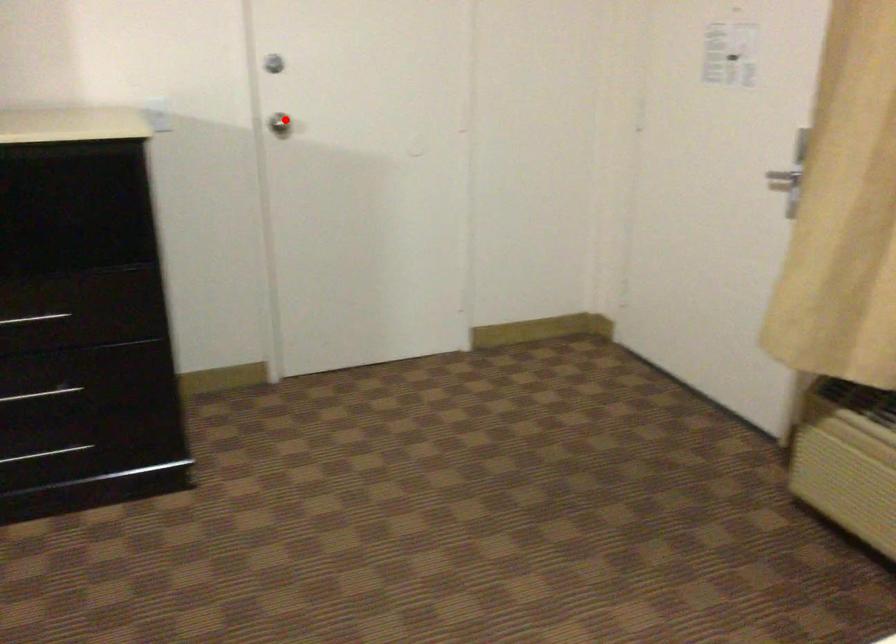
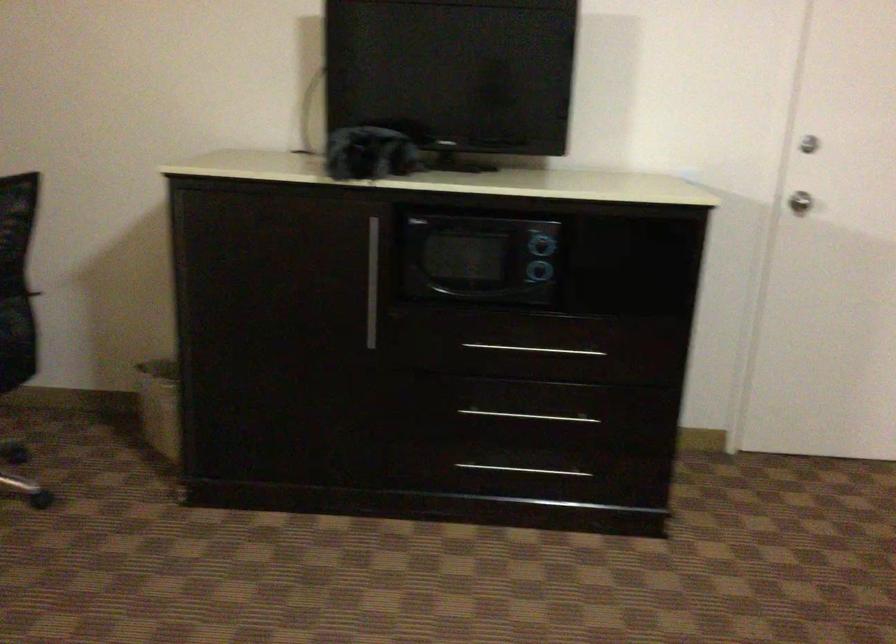
In the second image, find the point that corresponds to the highlighted location in the first image.

(803, 180)